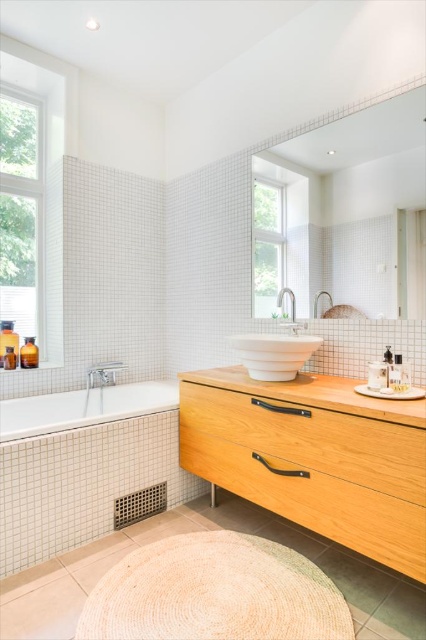
Question: From the image, what is the correct spatial relationship of clear glass window at upper center in relation to satin nickel faucet at center?

Choices:
 (A) right
 (B) left

Answer: (B)

Question: Which point is farther to the camera?

Choices:
 (A) (313, 298)
 (B) (270, 300)

Answer: (B)

Question: Considering the relative positions of white glossy sink at center and satin nickel faucet at upper center in the image provided, where is white glossy sink at center located with respect to satin nickel faucet at upper center?

Choices:
 (A) below
 (B) above

Answer: (A)

Question: Among these points, which one is nearest to the camera?

Choices:
 (A) (259, 333)
 (B) (103, 410)
 (C) (256, 419)
 (D) (207, 604)

Answer: (D)

Question: Which of the following is the closest to the observer?

Choices:
 (A) satin nickel faucet at upper center
 (B) clear glass window at upper left
 (C) light wood vanity at lower right
 (D) clear glass window at upper center

Answer: (C)

Question: Can you confirm if white glossy bathtub at lower left is positioned to the right of satin nickel faucet at center?

Choices:
 (A) yes
 (B) no

Answer: (B)